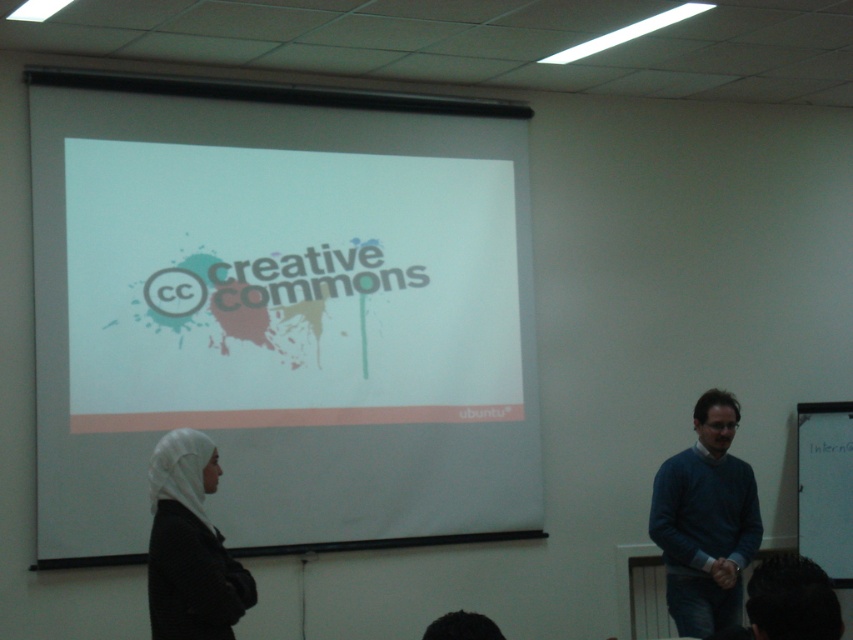
Question: Based on their relative distances, which object is nearer to the blue sweater at right?

Choices:
 (A) white matte hijab at lower left
 (B) white matte projection screen at center

Answer: (B)

Question: Does white matte projection screen at center appear on the left side of blue sweater at right?

Choices:
 (A) no
 (B) yes

Answer: (B)

Question: Which point is closer to the camera?

Choices:
 (A) white matte hijab at lower left
 (B) white matte projection screen at center

Answer: (A)

Question: Which object is farther from the camera taking this photo?

Choices:
 (A) blue sweater at right
 (B) white matte hijab at lower left

Answer: (A)

Question: Does white matte projection screen at center appear on the left side of blue sweater at right?

Choices:
 (A) yes
 (B) no

Answer: (A)

Question: Does white matte projection screen at center have a lesser width compared to white matte hijab at lower left?

Choices:
 (A) yes
 (B) no

Answer: (B)